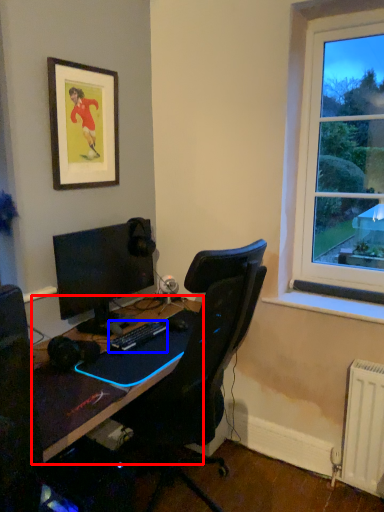
Question: Which point is closer to the camera, desk (highlighted by a red box) or computer keyboard (highlighted by a blue box)?

Choices:
 (A) desk
 (B) computer keyboard

Answer: (A)